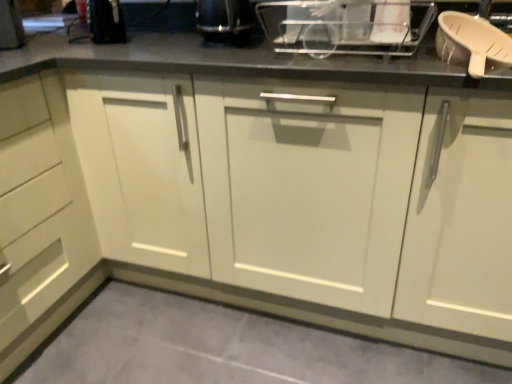
At what (x,y) coordinates should I click in order to perform the action: click on vacant area that is in front of black plastic kettle at upper center, acting as the 1th appliance starting from the left. Please return your answer as a coordinate pair (x, y). This screenshot has width=512, height=384. Looking at the image, I should click on (215, 55).